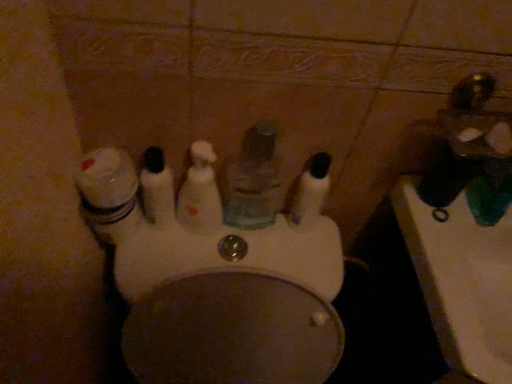
Question: Is white glossy jar at left smaller than gold metallic faucet at upper right?

Choices:
 (A) no
 (B) yes

Answer: (A)

Question: Does white glossy jar at left appear on the left side of gold metallic faucet at upper right?

Choices:
 (A) no
 (B) yes

Answer: (B)

Question: Is white glossy jar at left bigger than gold metallic faucet at upper right?

Choices:
 (A) yes
 (B) no

Answer: (A)

Question: From a real-world perspective, is white glossy jar at left over gold metallic faucet at upper right?

Choices:
 (A) no
 (B) yes

Answer: (A)

Question: Considering the relative sizes of white glossy jar at left and gold metallic faucet at upper right in the image provided, is white glossy jar at left shorter than gold metallic faucet at upper right?

Choices:
 (A) no
 (B) yes

Answer: (A)

Question: Considering the relative positions of white glossy jar at left and gold metallic faucet at upper right in the image provided, is white glossy jar at left behind gold metallic faucet at upper right?

Choices:
 (A) yes
 (B) no

Answer: (A)

Question: Considering the relative sizes of translucent plastic mouthwash at center, which is the second mouthwash in left-to-right order, and white glossy sink at lower right in the image provided, is translucent plastic mouthwash at center, which is the second mouthwash in left-to-right order, taller than white glossy sink at lower right?

Choices:
 (A) yes
 (B) no

Answer: (A)

Question: Is white glossy sink at lower right a part of translucent plastic mouthwash at center, which is the 3th mouthwash from right to left?

Choices:
 (A) no
 (B) yes

Answer: (A)

Question: Are translucent plastic mouthwash at center, which is the 3th mouthwash from right to left, and white glossy sink at lower right located far from each other?

Choices:
 (A) no
 (B) yes

Answer: (A)

Question: From the image's perspective, is translucent plastic mouthwash at center, which is the second mouthwash in left-to-right order, beneath white glossy sink at lower right?

Choices:
 (A) yes
 (B) no

Answer: (B)

Question: Is translucent plastic mouthwash at center, which is the second mouthwash in left-to-right order, touching white glossy sink at lower right?

Choices:
 (A) no
 (B) yes

Answer: (A)

Question: Is translucent plastic mouthwash at center, which is the 3th mouthwash from right to left, oriented away from white glossy sink at lower right?

Choices:
 (A) no
 (B) yes

Answer: (A)

Question: From a real-world perspective, is white glossy toilet at center physically below translucent plastic mouthwash at center, the 1th mouthwash in the right-to-left sequence?

Choices:
 (A) yes
 (B) no

Answer: (A)